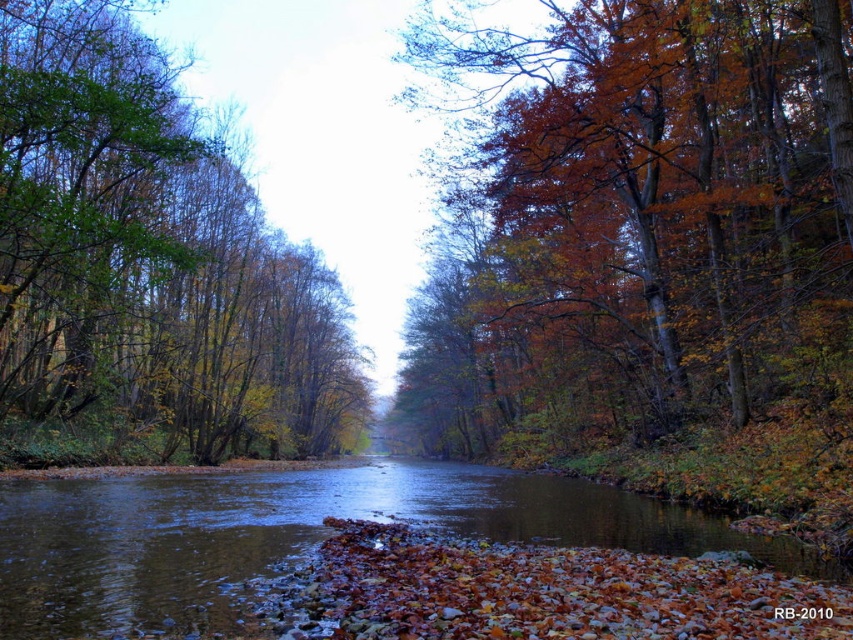
Question: Can you confirm if autumn leaves at right is positioned below brown smooth water at center?

Choices:
 (A) no
 (B) yes

Answer: (A)

Question: Among these points, which one is farthest from the camera?

Choices:
 (A) tap(817, 336)
 (B) tap(71, 134)

Answer: (B)

Question: Among these objects, which one is farthest from the camera?

Choices:
 (A) green leafy tree at left
 (B) autumn leaves at right
 (C) brown smooth water at center

Answer: (A)

Question: Considering the relative positions of green leafy tree at left and brown smooth water at center in the image provided, where is green leafy tree at left located with respect to brown smooth water at center?

Choices:
 (A) above
 (B) below

Answer: (A)

Question: Can you confirm if autumn leaves at right is smaller than brown smooth water at center?

Choices:
 (A) yes
 (B) no

Answer: (B)

Question: Among these objects, which one is nearest to the camera?

Choices:
 (A) autumn leaves at right
 (B) brown smooth water at center

Answer: (B)